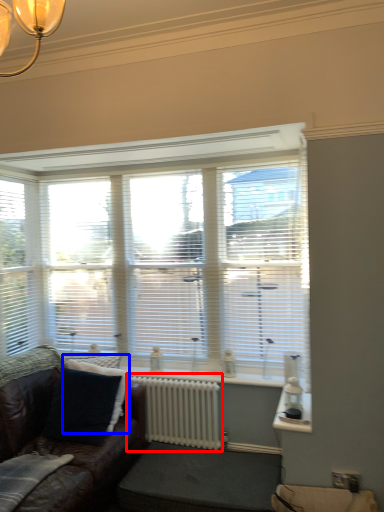
Question: Which object is further to the camera taking this photo, radiator (highlighted by a red box) or pillow (highlighted by a blue box)?

Choices:
 (A) radiator
 (B) pillow

Answer: (A)